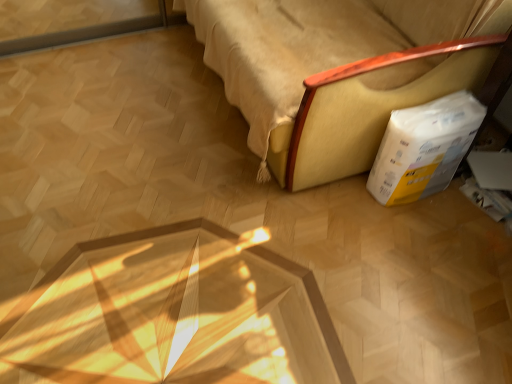
Question: Does white/yellow cardboard box at lower right have a lesser height compared to yellow fabric sofa at lower right?

Choices:
 (A) yes
 (B) no

Answer: (A)

Question: From a real-world perspective, is white/yellow cardboard box at lower right below yellow fabric sofa at lower right?

Choices:
 (A) no
 (B) yes

Answer: (B)

Question: Is yellow fabric sofa at lower right inside white/yellow cardboard box at lower right?

Choices:
 (A) yes
 (B) no

Answer: (B)

Question: Is white/yellow cardboard box at lower right far away from yellow fabric sofa at lower right?

Choices:
 (A) yes
 (B) no

Answer: (B)

Question: Is white/yellow cardboard box at lower right completely or partially outside of yellow fabric sofa at lower right?

Choices:
 (A) yes
 (B) no

Answer: (A)

Question: Is white/yellow cardboard box at lower right at the right side of yellow fabric sofa at lower right?

Choices:
 (A) yes
 (B) no

Answer: (A)

Question: Considering the relative sizes of yellow fabric sofa at lower right and white/yellow cardboard box at lower right in the image provided, is yellow fabric sofa at lower right smaller than white/yellow cardboard box at lower right?

Choices:
 (A) no
 (B) yes

Answer: (A)

Question: Is yellow fabric sofa at lower right to the left of white/yellow cardboard box at lower right from the viewer's perspective?

Choices:
 (A) no
 (B) yes

Answer: (B)

Question: Is yellow fabric sofa at lower right wider than white/yellow cardboard box at lower right?

Choices:
 (A) yes
 (B) no

Answer: (A)

Question: Is yellow fabric sofa at lower right with white/yellow cardboard box at lower right?

Choices:
 (A) no
 (B) yes

Answer: (A)

Question: Is yellow fabric sofa at lower right thinner than white/yellow cardboard box at lower right?

Choices:
 (A) yes
 (B) no

Answer: (B)

Question: Is yellow fabric sofa at lower right not within white/yellow cardboard box at lower right?

Choices:
 (A) yes
 (B) no

Answer: (A)

Question: Considering the positions of yellow fabric sofa at lower right and white/yellow cardboard box at lower right in the image, is yellow fabric sofa at lower right wider or thinner than white/yellow cardboard box at lower right?

Choices:
 (A) wide
 (B) thin

Answer: (A)